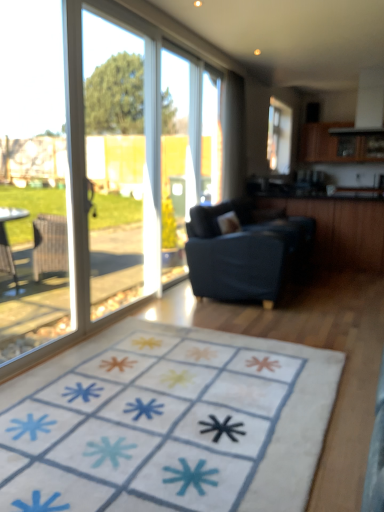
Question: Considering the relative positions of white soft rug at center and transparent plastic window screen at center, which is the 1th window screen from back to front, in the image provided, is white soft rug at center to the left of transparent plastic window screen at center, which is the 1th window screen from back to front, from the viewer's perspective?

Choices:
 (A) no
 (B) yes

Answer: (B)

Question: Can we say white soft rug at center lies outside transparent plastic window screen at center, which is the 1th window screen from back to front?

Choices:
 (A) yes
 (B) no

Answer: (A)

Question: Considering the relative sizes of white soft rug at center and transparent plastic window screen at center, the 1th window screen in the right-to-left sequence, in the image provided, is white soft rug at center bigger than transparent plastic window screen at center, the 1th window screen in the right-to-left sequence,?

Choices:
 (A) yes
 (B) no

Answer: (A)

Question: From a real-world perspective, is white soft rug at center over transparent plastic window screen at center, which is the 1th window screen from back to front?

Choices:
 (A) yes
 (B) no

Answer: (B)

Question: Does white soft rug at center appear on the right side of transparent plastic window screen at center, the 1th window screen in the right-to-left sequence?

Choices:
 (A) yes
 (B) no

Answer: (B)

Question: Is white soft rug at center positioned with its back to transparent plastic window screen at center, which is counted as the second window screen, starting from the left?

Choices:
 (A) no
 (B) yes

Answer: (A)

Question: Considering the relative positions of transparent plastic window screen at center, the 1th window screen in the right-to-left sequence, and transparent glass window at left, which ranks as the 2th window screen in right-to-left order, in the image provided, is transparent plastic window screen at center, the 1th window screen in the right-to-left sequence, to the right of transparent glass window at left, which ranks as the 2th window screen in right-to-left order, from the viewer's perspective?

Choices:
 (A) no
 (B) yes

Answer: (B)

Question: Considering the relative positions of transparent plastic window screen at center, placed as the second window screen when sorted from front to back, and transparent glass window at left, which ranks as the 2th window screen in right-to-left order, in the image provided, is transparent plastic window screen at center, placed as the second window screen when sorted from front to back, to the left of transparent glass window at left, which ranks as the 2th window screen in right-to-left order, from the viewer's perspective?

Choices:
 (A) no
 (B) yes

Answer: (A)

Question: Is transparent plastic window screen at center, which is the 1th window screen from back to front, oriented away from transparent glass window at left, which is the 1th window screen from left to right?

Choices:
 (A) yes
 (B) no

Answer: (B)

Question: Does transparent plastic window screen at center, which is the 1th window screen from back to front, lie in front of transparent glass window at left, acting as the first window screen starting from the front?

Choices:
 (A) no
 (B) yes

Answer: (A)

Question: Is transparent plastic window screen at center, the 1th window screen in the right-to-left sequence, far from transparent glass window at left, which is the 1th window screen from left to right?

Choices:
 (A) yes
 (B) no

Answer: (A)

Question: Is transparent plastic window screen at center, the 1th window screen in the right-to-left sequence, positioned beyond the bounds of transparent glass window at left, which ranks as the 2th window screen in right-to-left order?

Choices:
 (A) no
 (B) yes

Answer: (B)

Question: Does white soft rug at center have a larger size compared to transparent glass screen door at left?

Choices:
 (A) no
 (B) yes

Answer: (A)